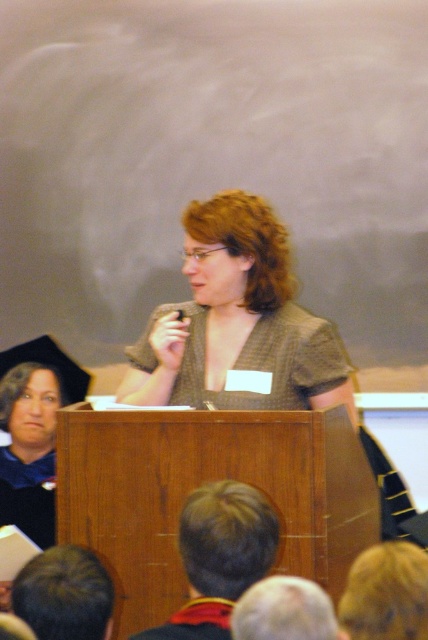
Between brown textured blouse at center and matte black shirt at upper left, which one has more height?

Standing taller between the two is brown textured blouse at center.

Does brown textured blouse at center have a greater height compared to matte black shirt at upper left?

Yes.

Where is `brown textured blouse at center`? The width and height of the screenshot is (428, 640). brown textured blouse at center is located at coordinates (237, 321).